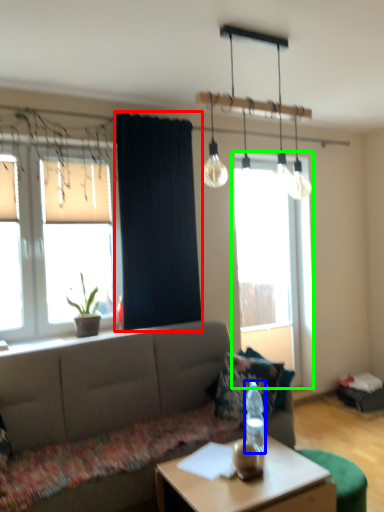
Question: Based on their relative distances, which object is farther from curtain (highlighted by a red box)? Choose from bottle (highlighted by a blue box) and window (highlighted by a green box).

Choices:
 (A) bottle
 (B) window

Answer: (B)